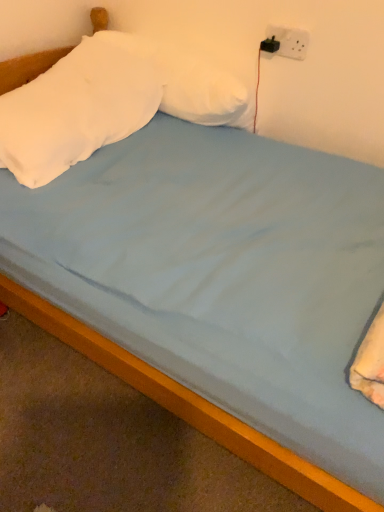
Question: Considering the relative sizes of white soft pillow at upper left, which is the 2th pillow from right to left, and white plastic socket at upper right in the image provided, is white soft pillow at upper left, which is the 2th pillow from right to left, shorter than white plastic socket at upper right?

Choices:
 (A) no
 (B) yes

Answer: (A)

Question: Is white soft pillow at upper left, the 1th pillow when ordered from left to right, further to the viewer compared to white plastic socket at upper right?

Choices:
 (A) no
 (B) yes

Answer: (A)

Question: Can you confirm if white soft pillow at upper left, the 1th pillow when ordered from left to right, is positioned to the left of white plastic socket at upper right?

Choices:
 (A) yes
 (B) no

Answer: (A)

Question: Is white soft pillow at upper left, which is the 2th pillow from right to left, located outside white plastic socket at upper right?

Choices:
 (A) no
 (B) yes

Answer: (B)

Question: Is white soft pillow at upper left, which is the 2th pillow from right to left, thinner than white plastic socket at upper right?

Choices:
 (A) no
 (B) yes

Answer: (A)

Question: In the image, is white soft pillow at upper center, the 2th pillow positioned from the left, on the left side or the right side of white plastic socket at upper right?

Choices:
 (A) right
 (B) left

Answer: (B)

Question: Is white soft pillow at upper center, the 2th pillow positioned from the left, taller or shorter than white plastic socket at upper right?

Choices:
 (A) tall
 (B) short

Answer: (A)

Question: From the image's perspective, is white soft pillow at upper center, the 2th pillow positioned from the left, above or below white plastic socket at upper right?

Choices:
 (A) below
 (B) above

Answer: (A)

Question: Is white soft pillow at upper center, the 2th pillow positioned from the left, in front of or behind white plastic socket at upper right in the image?

Choices:
 (A) behind
 (B) front

Answer: (B)

Question: From the image's perspective, is wooden bed frame at lower center positioned above or below white plastic socket at upper right?

Choices:
 (A) below
 (B) above

Answer: (A)

Question: From a real-world perspective, is wooden bed frame at lower center positioned above or below white plastic socket at upper right?

Choices:
 (A) above
 (B) below

Answer: (B)

Question: Looking at their shapes, would you say wooden bed frame at lower center is wider or thinner than white plastic socket at upper right?

Choices:
 (A) wide
 (B) thin

Answer: (A)

Question: Is wooden bed frame at lower center situated inside white plastic socket at upper right or outside?

Choices:
 (A) outside
 (B) inside

Answer: (A)

Question: From a real-world perspective, is white plastic socket at upper right above or below white soft pillow at upper center, the 2th pillow positioned from the left?

Choices:
 (A) above
 (B) below

Answer: (A)

Question: Visually, is white plastic socket at upper right positioned to the left or to the right of white soft pillow at upper center, acting as the 1th pillow starting from the right?

Choices:
 (A) right
 (B) left

Answer: (A)